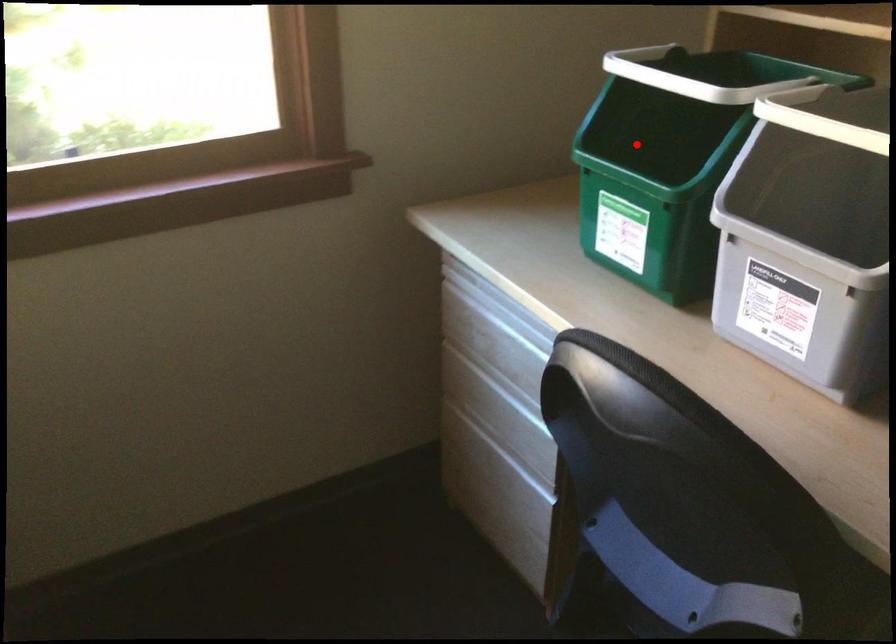
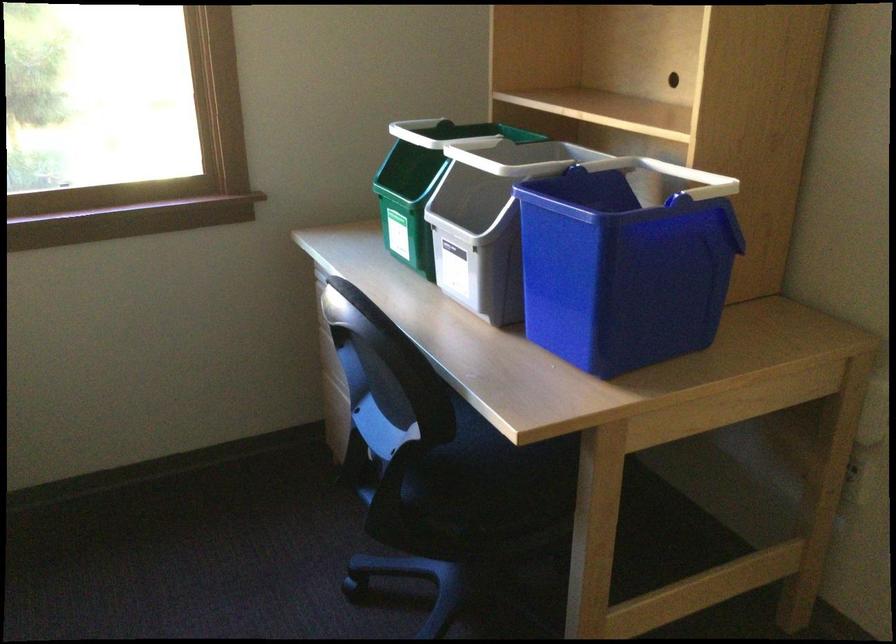
Question: A red point is marked in image1. In image2, is the corresponding 3D point closer to the camera or farther? Reply with the corresponding letter.

Choices:
 (A) The corresponding 3D point is closer.
 (B) The corresponding 3D point is farther.

Answer: (B)